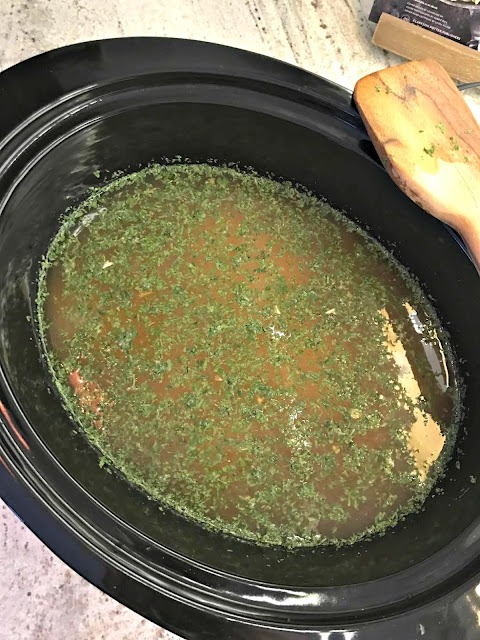
Where is `wooden utensil`? wooden utensil is located at coordinates click(x=439, y=172).